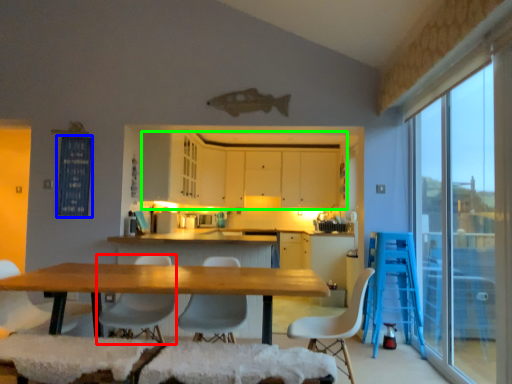
Question: Considering the real-world distances, which object is farthest from chair (highlighted by a red box)? window screen (highlighted by a blue box) or cabinetry (highlighted by a green box)?

Choices:
 (A) window screen
 (B) cabinetry

Answer: (B)